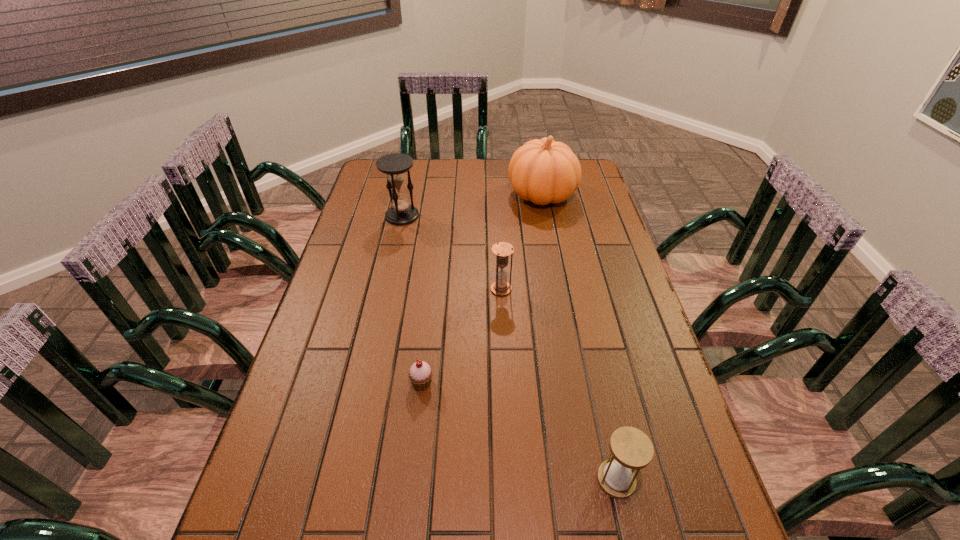
Where is `pumpkin`? This screenshot has height=540, width=960. pumpkin is located at coordinates (544, 171).

Locate an element on the screen. This screenshot has height=540, width=960. the leftmost hourglass is located at coordinates (395, 166).

You are a GUI agent. You are given a task and a screenshot of the screen. Output one action in this format:
    pyautogui.click(x=<x>, y=<y>)
    Task: Click on the farthest hourglass
    
    Given the screenshot: What is the action you would take?
    pyautogui.click(x=395, y=166)

The image size is (960, 540). I want to click on the second hourglass from right to left, so click(502, 250).

The width and height of the screenshot is (960, 540). I want to click on the third nearest object, so click(x=502, y=250).

Where is `the rightmost hourglass`? The image size is (960, 540). the rightmost hourglass is located at coordinates (631, 449).

Locate an element on the screen. The width and height of the screenshot is (960, 540). the nearest object is located at coordinates (631, 449).

Image resolution: width=960 pixels, height=540 pixels. In order to click on the fourth farthest object in this screenshot , I will do `click(420, 374)`.

Where is `the fourth object from right to left`? The height and width of the screenshot is (540, 960). the fourth object from right to left is located at coordinates (420, 374).

Find the location of a particular element. The image size is (960, 540). free spot located on the front of the pumpkin is located at coordinates (554, 260).